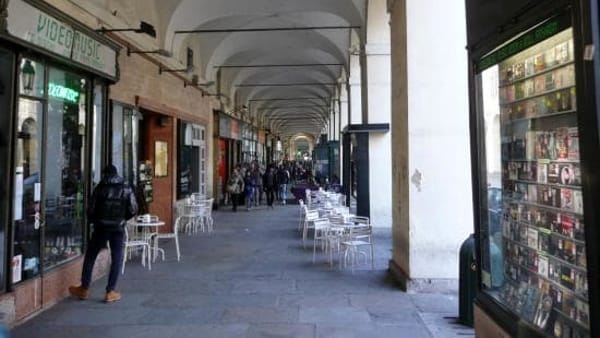
You are a GUI agent. You are given a task and a screenshot of the screen. Output one action in this format:
    pyautogui.click(x=<x>, y=<y>)
    Task: Click on the hole in plaster
    
    Given the screenshot: What is the action you would take?
    pyautogui.click(x=417, y=179)